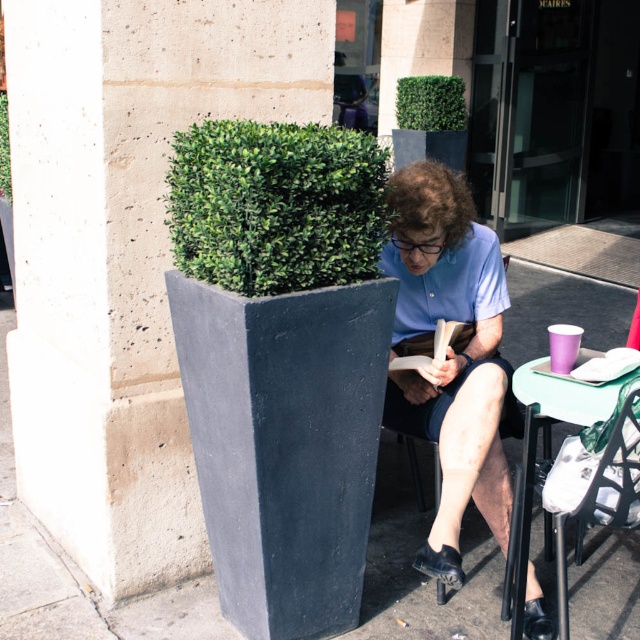
You are a delivery person who needs to place a large package next to the smooth concrete planter at left and the green textured hedge at upper center. Which object can you place the package next to without it being too small?

The smooth concrete planter at left is bigger than the green textured hedge at upper center, so you can place the package next to the smooth concrete planter at left since it has more space.

Based on the scene description, what are the coordinates of the smooth concrete planter at left?

The smooth concrete planter at left is located at coordinates point (x=124, y=252).

You are standing at a point 2 meters away from the camera. You want to move towards the point marked as point (451, 346). Will you get closer to the camera or farther away from it?

The distance of point (451, 346) from camera is 2.53 meters. Since you are moving from 2 meters to 2.53 meters away from the camera, you will be moving farther away from the camera.